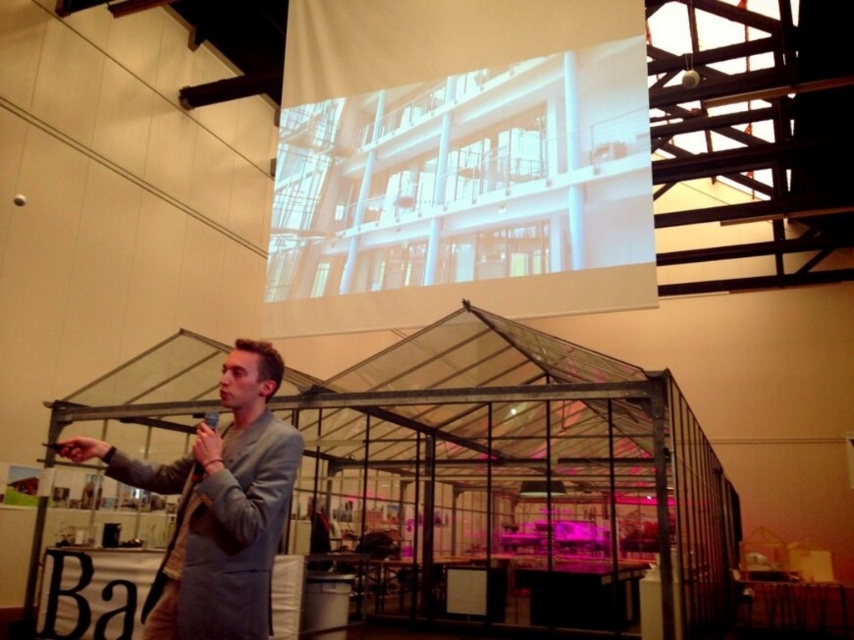
Does point (582, 28) come in front of point (208, 541)?

No, it is behind (208, 541).

Does white matte projection screen at upper center have a lesser height compared to light gray suit at center?

In fact, white matte projection screen at upper center may be taller than light gray suit at center.

Which is in front, point (533, 224) or point (255, 408)?

Point (255, 408) is more forward.

The height and width of the screenshot is (640, 854). Identify the location of white matte projection screen at upper center. (459, 163).